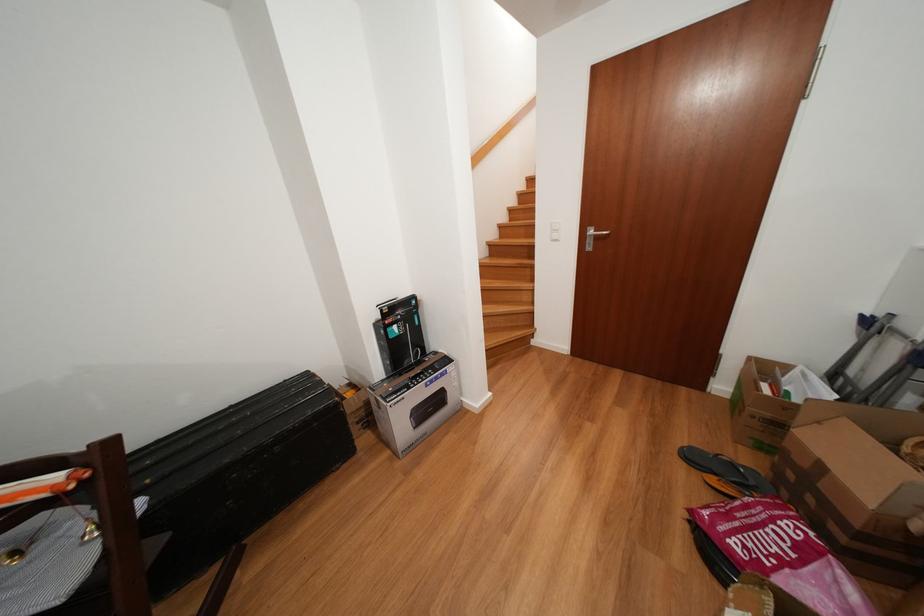
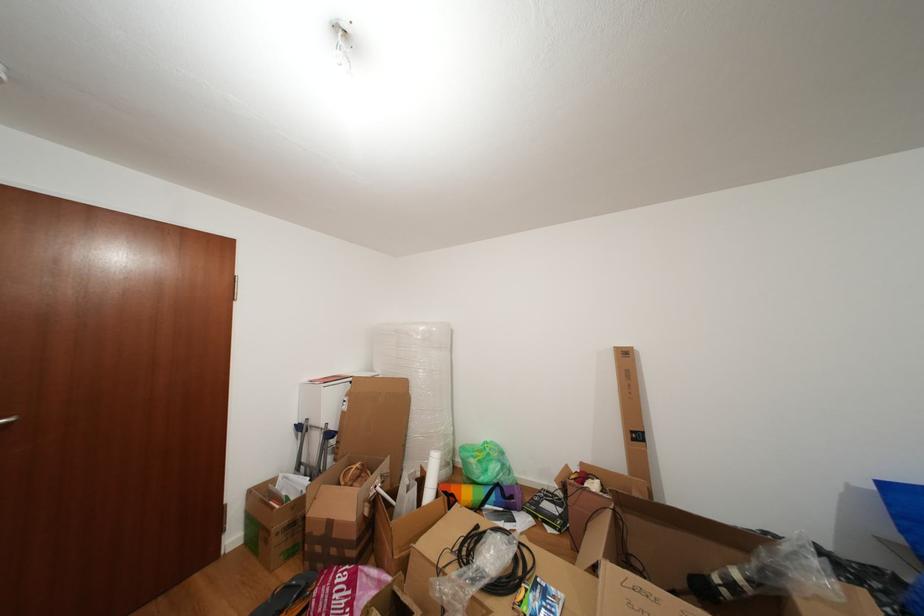
The point at (829, 472) is marked in the first image. Where is the corresponding point in the second image?

(338, 529)